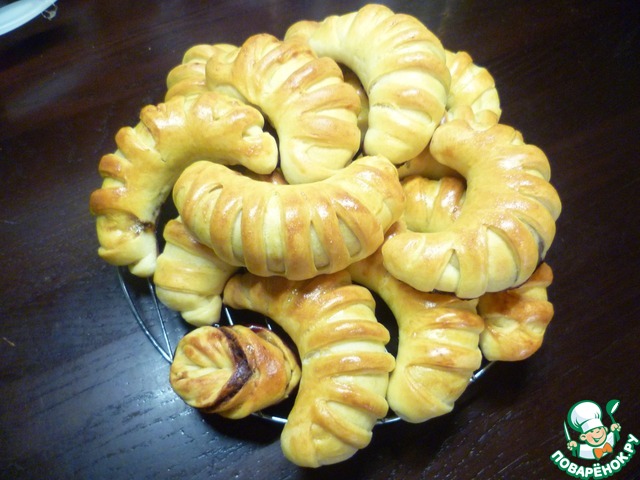
The image size is (640, 480). In order to click on light reflecting off table in this screenshot , I will do tap(115, 382).